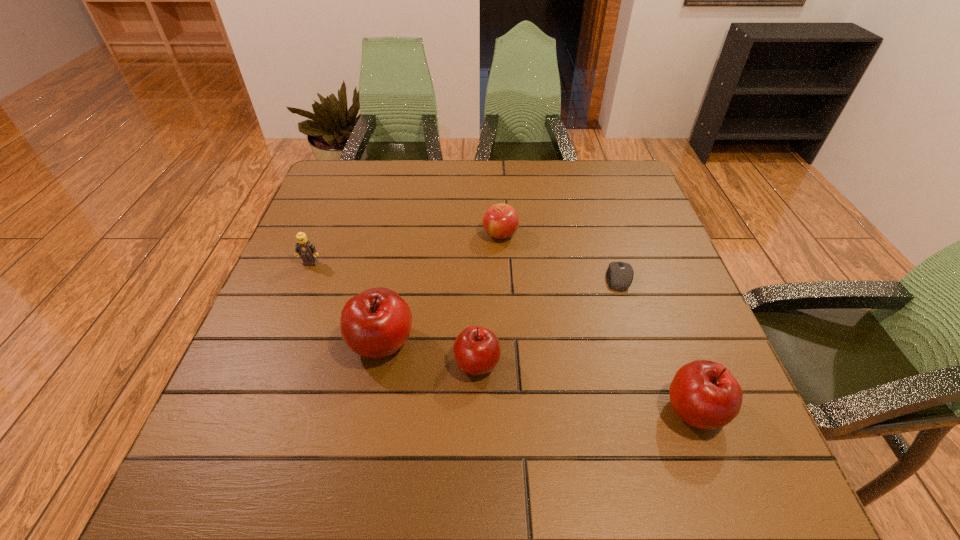
Where is `the third closest apple relative to the computer equipment`? the third closest apple relative to the computer equipment is located at coordinates [x=477, y=351].

Locate an element on the screen. Image resolution: width=960 pixels, height=540 pixels. vacant space that satisfies the following two spatial constraints: 1. in front of the leftmost object; 2. on the left side of the fifth shortest object is located at coordinates (252, 410).

Locate an element on the screen. free location that satisfies the following two spatial constraints: 1. in front of the second shortest apple; 2. on the right side of the Lego is located at coordinates (271, 363).

This screenshot has width=960, height=540. Find the location of `vacant space that satisfies the following two spatial constraints: 1. in front of the third shortest apple; 2. on the left side of the leftmost object`. vacant space that satisfies the following two spatial constraints: 1. in front of the third shortest apple; 2. on the left side of the leftmost object is located at coordinates (252, 410).